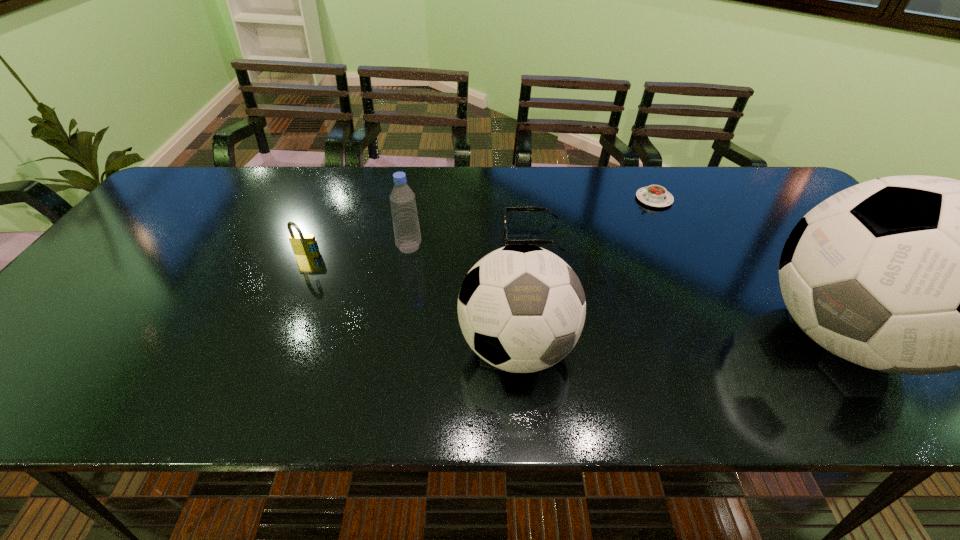
The height and width of the screenshot is (540, 960). In order to click on free location located at the front lenses of the second shortest object in this screenshot , I will do `click(389, 237)`.

You are a GUI agent. You are given a task and a screenshot of the screen. Output one action in this format:
    pyautogui.click(x=<x>, y=<y>)
    Task: Click on the free space located 0.090m at the front lenses of the second shortest object
    The height and width of the screenshot is (540, 960).
    Given the screenshot: What is the action you would take?
    click(x=471, y=237)

Identify the location of vacant area situated at the front lenses of the second shortest object. The width and height of the screenshot is (960, 540). (407, 237).

Where is `object located in the far edge section of the desktop`? This screenshot has height=540, width=960. object located in the far edge section of the desktop is located at coordinates (654, 195).

Identify the location of object that is at the near edge. (521, 308).

In the image, there is a desktop. Where is `vacant space at the far edge`? vacant space at the far edge is located at coordinates coord(562,174).

In the image, there is a desktop. What are the coordinates of `free space at the near edge` in the screenshot? It's located at (121, 340).

Where is `vacant region at the left edge of the desktop`? The image size is (960, 540). vacant region at the left edge of the desktop is located at coordinates (60, 329).

This screenshot has height=540, width=960. What are the coordinates of `vacant area at the far left corner` in the screenshot? It's located at (166, 208).

This screenshot has height=540, width=960. I want to click on blank space at the far right corner of the desktop, so click(771, 205).